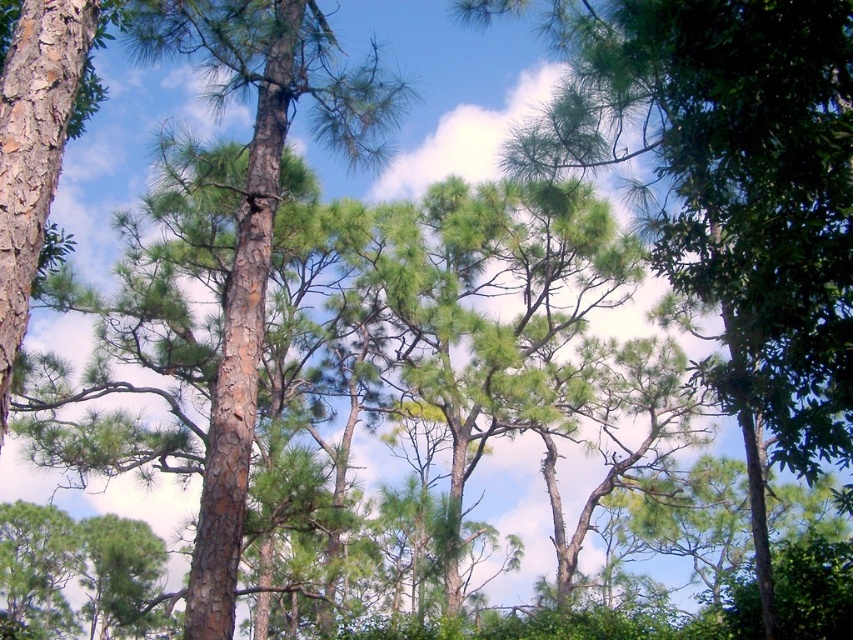
You are standing in the forest looking at the green matte tree at center and the brown rough bark tree at left. Which tree appears closer to you?

The green matte tree at center appears closer to you because it is positioned below the brown rough bark tree at left, indicating it is in a lower plane and thus nearer in the visual perspective.

You are standing in a forest and want to take a photo of the green matte tree at center. If your camera has a maximum focus range of 20 feet, will you need to move closer to capture it clearly?

The green matte tree at center is 21.81 feet away from the camera, which exceeds the maximum focus range of 20 feet. Therefore, you need to move closer to ensure the tree is in focus.

You are a photographer standing in the forest scene. You want to take a photo focusing on the point at coordinates point (519, 147) and point (184, 38). Which point will appear larger in the photo?

Point (519, 147) is closer to the camera than point (184, 38), so it will appear larger in the photo.